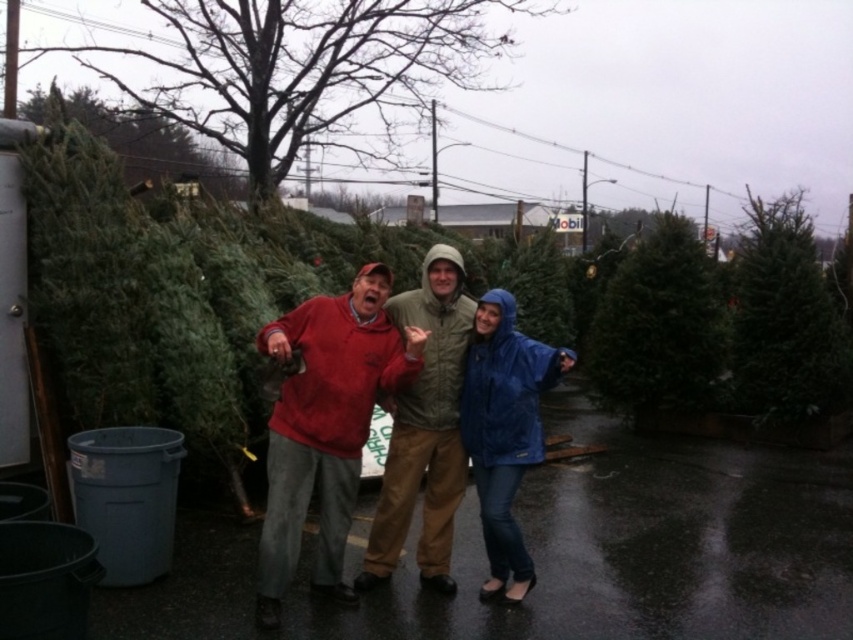
Who is taller, green textured pine tree at upper center or green matte christmas tree at upper right?

Standing taller between the two is green textured pine tree at upper center.

Who is lower down, green textured pine tree at upper center or green matte christmas tree at upper right?

green matte christmas tree at upper right

I want to click on green textured pine tree at upper center, so click(x=305, y=70).

Who is taller, matte red hoodie at center or matte green jacket at center?

Standing taller between the two is matte green jacket at center.

Between matte red hoodie at center and matte green jacket at center, which one is positioned lower?

matte red hoodie at center is lower down.

Image resolution: width=853 pixels, height=640 pixels. What do you see at coordinates (325, 426) in the screenshot? I see `matte red hoodie at center` at bounding box center [325, 426].

Where is `matte red hoodie at center`? matte red hoodie at center is located at coordinates (325, 426).

Which is more to the right, green matte christmas tree at upper right or blue waterproof jacket at center?

From the viewer's perspective, green matte christmas tree at upper right appears more on the right side.

Which is behind, point (815, 346) or point (503, 570)?

Positioned behind is point (815, 346).

Image resolution: width=853 pixels, height=640 pixels. What are the coordinates of `green matte christmas tree at upper right` in the screenshot? It's located at (784, 317).